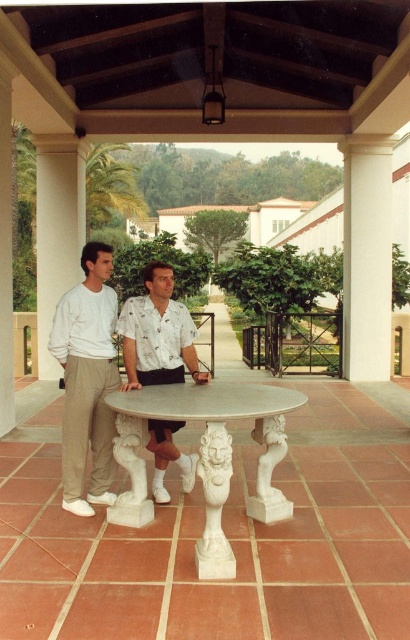
Can you confirm if white cotton pants at center is positioned to the left of white marble column at right?

Correct, you'll find white cotton pants at center to the left of white marble column at right.

Which is above, white cotton pants at center or white marble column at right?

white marble column at right

Between point (93, 368) and point (378, 225), which one is positioned behind?

The point (378, 225) is more distant.

Where is `white cotton pants at center`? The image size is (410, 640). white cotton pants at center is located at coordinates (86, 380).

In the scene shown: Is white marble pillar at left to the left of white stone lion at center from the viewer's perspective?

Correct, you'll find white marble pillar at left to the left of white stone lion at center.

Who is more distant from viewer, (79, 193) or (214, 433)?

Positioned behind is point (79, 193).

Is point (56, 243) farther from viewer compared to point (207, 422)?

That is True.

Where is `white marble pillar at left`? The height and width of the screenshot is (640, 410). white marble pillar at left is located at coordinates tap(56, 230).

How much distance is there between white marble column at right and white marble lion at lower center?

white marble column at right is 5.18 meters away from white marble lion at lower center.

Is white marble column at right shorter than white marble lion at lower center?

No.

The height and width of the screenshot is (640, 410). In order to click on white marble column at right in this screenshot , I will do `click(366, 257)`.